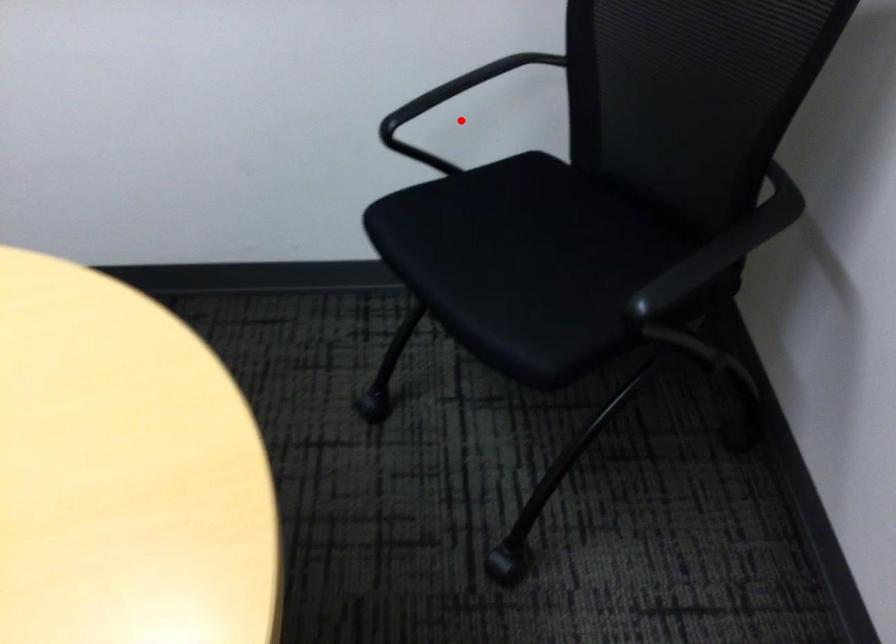
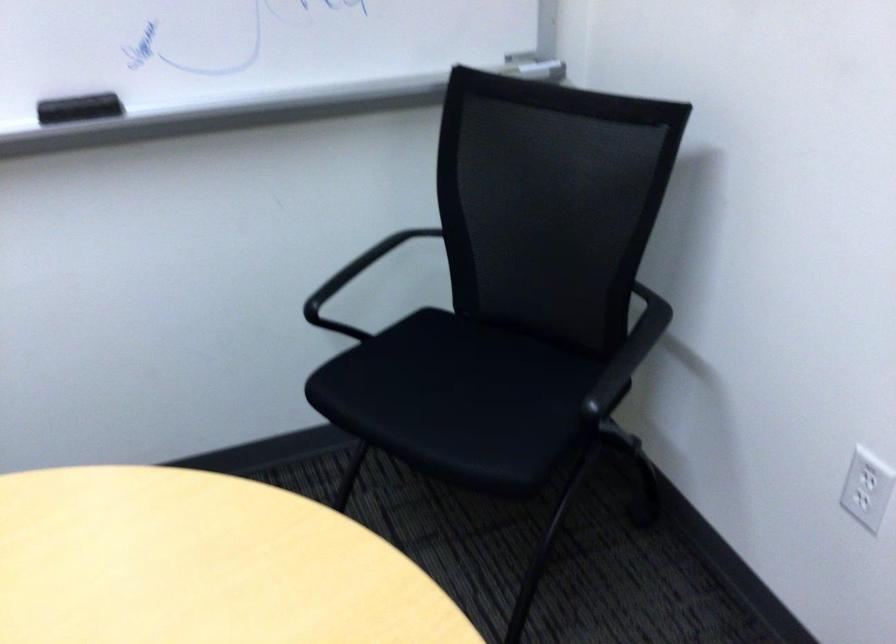
Question: I am providing you with two images of the same scene from different viewpoints. Image1 has a red point marked. In image2, the corresponding 3D location appears at what relative position? Reply with the corresponding letter.

Choices:
 (A) Closer
 (B) Farther

Answer: (B)